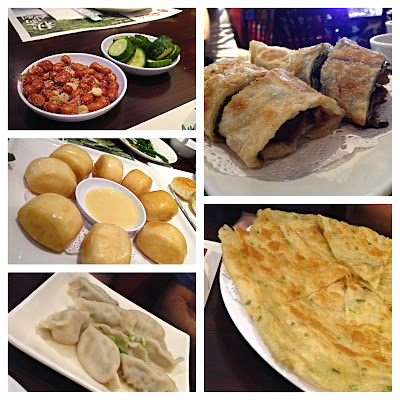
I want to click on plate, so click(9, 321), click(31, 255), click(36, 109), click(105, 46), click(261, 188), click(238, 316).